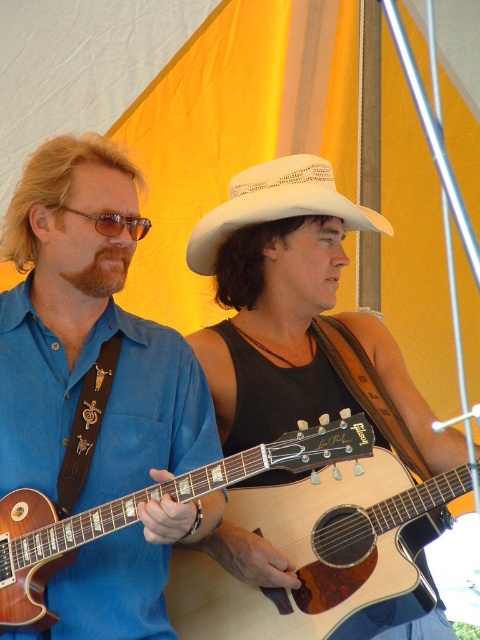
Which is below, brownwoodybeard at left or matte brown sunglasses at left?

brownwoodybeard at left is lower down.

Does point (99, 269) come behind point (145, 227)?

Yes, point (99, 269) is behind point (145, 227).

The image size is (480, 640). In order to click on brownwoodybeard at left in this screenshot , I will do `click(101, 272)`.

Is wooden acoustic guitar at center bigger than matte brown sunglasses at left?

Yes, wooden acoustic guitar at center is bigger than matte brown sunglasses at left.

Can you confirm if wooden acoustic guitar at center is wider than matte brown sunglasses at left?

Yes.

Which is behind, point (298, 444) or point (112, 228)?

The point (112, 228) is behind.

The width and height of the screenshot is (480, 640). Find the location of `wooden acoustic guitar at center`. wooden acoustic guitar at center is located at coordinates (136, 512).

Does point (348, 216) lie in front of point (144, 225)?

No.

Which is above, white woven cowboy hat at center or matte brown sunglasses at left?

Positioned higher is white woven cowboy hat at center.

What are the coordinates of `white woven cowboy hat at center` in the screenshot? It's located at (276, 205).